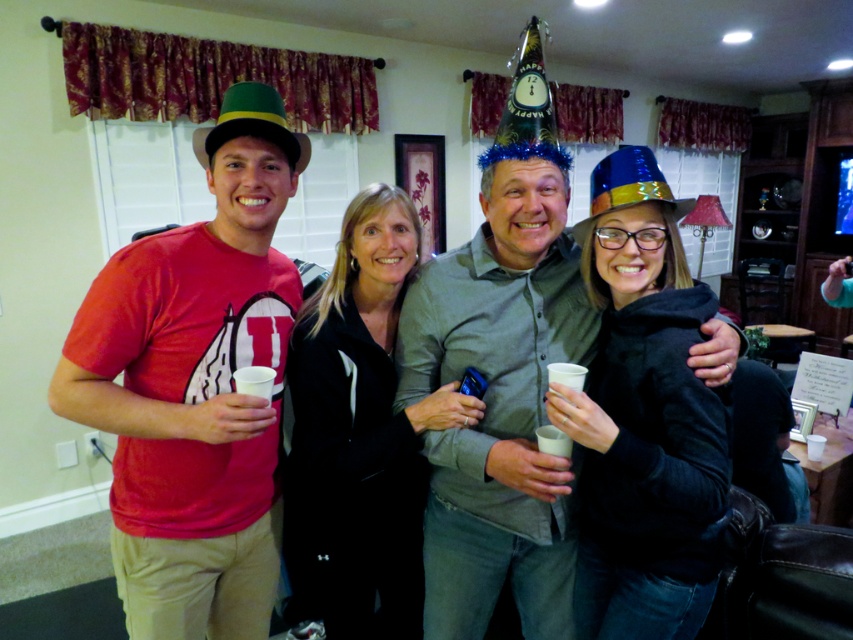
Question: Is black matte jacket at center wider than shiny metallic party hat at center?

Choices:
 (A) yes
 (B) no

Answer: (A)

Question: Among these points, which one is farthest from the camera?

Choices:
 (A) (248, 90)
 (B) (260, 387)
 (C) (273, 570)

Answer: (C)

Question: Which point is closer to the camera?

Choices:
 (A) (582, 380)
 (B) (374, 634)
 (C) (282, 112)
 (D) (258, 374)

Answer: (A)

Question: Is matte gray shirt at center smaller than black matte jacket at center?

Choices:
 (A) no
 (B) yes

Answer: (B)

Question: Considering the real-world distances, which object is farthest from the shiny metallic party hat at center?

Choices:
 (A) black matte jacket at center
 (B) green felt party hat at upper left

Answer: (A)

Question: Can you confirm if black matte jacket at center is positioned to the left of shiny metallic party hat at center?

Choices:
 (A) no
 (B) yes

Answer: (B)